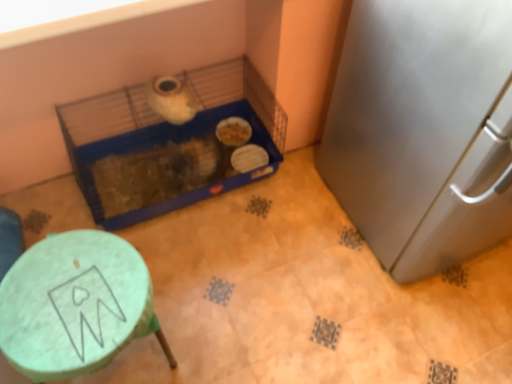
I want to click on free space in front of dark brown textured bedding at center, so click(x=156, y=250).